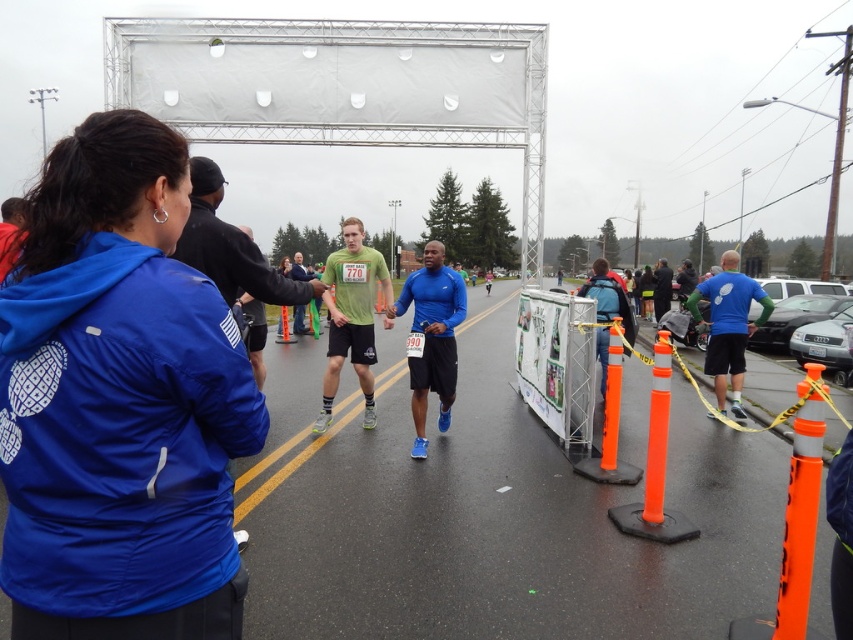
Who is shorter, blue fabric jacket at upper left or blue matte running shoe at center?

blue fabric jacket at upper left

Is blue fabric jacket at upper left below blue matte running shoe at center?

Actually, blue fabric jacket at upper left is above blue matte running shoe at center.

Identify the location of blue fabric jacket at upper left. The image size is (853, 640). pyautogui.click(x=119, y=403).